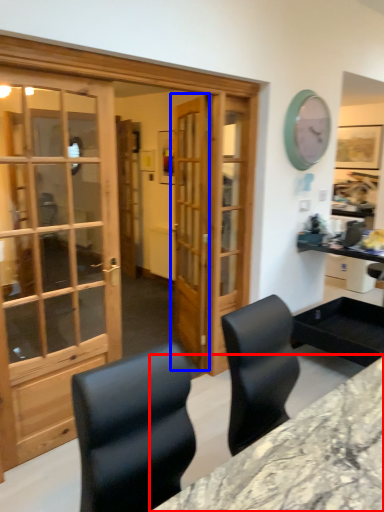
Question: Which object is further to the camera taking this photo, desk (highlighted by a red box) or door (highlighted by a blue box)?

Choices:
 (A) desk
 (B) door

Answer: (B)